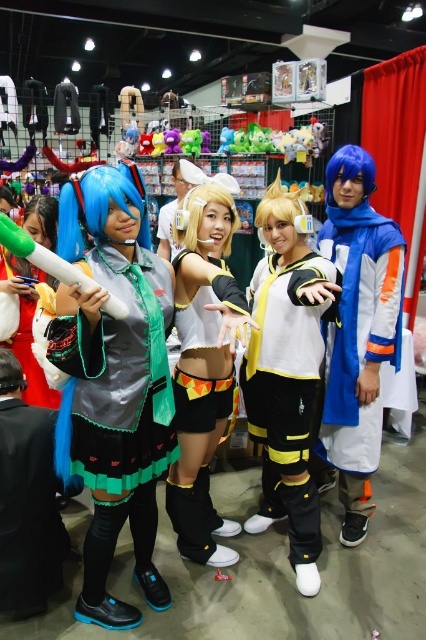
Who is positioned more to the right, shiny silver dress at center or white matte shorts at center?

From the viewer's perspective, white matte shorts at center appears more on the right side.

Is shiny silver dress at center to the right of white matte shorts at center from the viewer's perspective?

No, shiny silver dress at center is not to the right of white matte shorts at center.

Does point (94, 352) come in front of point (207, 308)?

Yes, point (94, 352) is in front of point (207, 308).

You are a GUI agent. You are given a task and a screenshot of the screen. Output one action in this format:
    pyautogui.click(x=<x>, y=<y>)
    Task: Click on the shiny silver dress at center
    Image resolution: width=426 pixels, height=640 pixels.
    Given the screenshot: What is the action you would take?
    pyautogui.click(x=117, y=380)

Who is taller, blue fabric jacket at right or white matte uniform at center?

blue fabric jacket at right

Is blue fabric jacket at right shorter than white matte uniform at center?

In fact, blue fabric jacket at right may be taller than white matte uniform at center.

Between point (382, 296) and point (301, 369), which one is positioned in front?

Point (301, 369) is in front.

Where is `blue fabric jacket at right`? The height and width of the screenshot is (640, 426). blue fabric jacket at right is located at coordinates (356, 333).

Which is more to the left, shiny silver jacket at center or white satin skirt at center?

white satin skirt at center

Measure the distance between point (268, 428) and camera.

Point (268, 428) is 6.90 feet away from camera.

Measure the distance between shiny silver jacket at center and camera.

A distance of 4.49 feet exists between shiny silver jacket at center and camera.

Find the location of a particular element. shiny silver jacket at center is located at coordinates pyautogui.click(x=301, y=337).